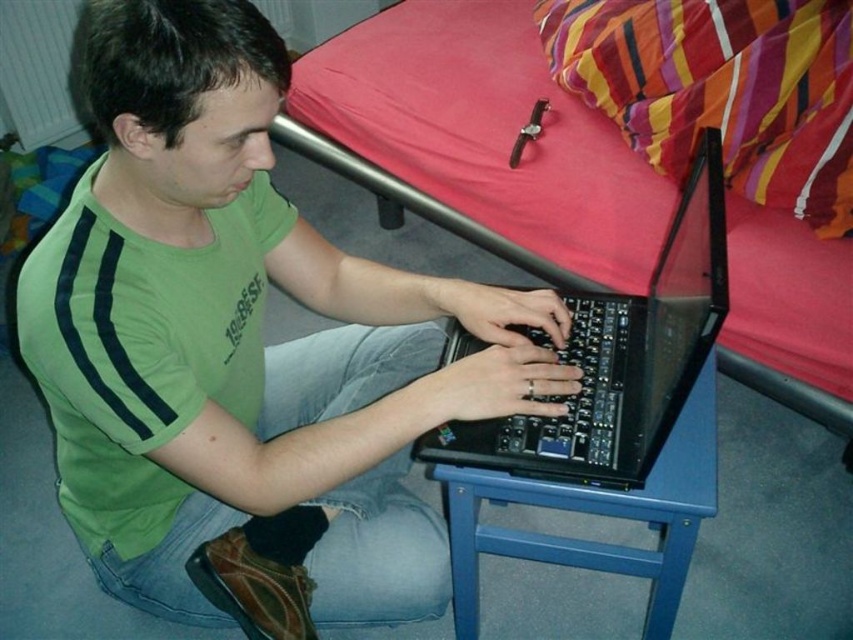
Question: Can you confirm if pink fabric bed at upper center is bigger than black plastic laptop at center?

Choices:
 (A) yes
 (B) no

Answer: (A)

Question: Which is nearer to the black plastic laptop at center?

Choices:
 (A) green fabric shirt at center
 (B) pink fabric bed at upper center
 (C) blue plastic stool at lower center

Answer: (C)

Question: Can you confirm if green fabric shirt at center is wider than pink fabric bed at upper center?

Choices:
 (A) no
 (B) yes

Answer: (A)

Question: Which of these objects is positioned farthest from the pink fabric bed at upper center?

Choices:
 (A) green fabric shirt at center
 (B) blue plastic stool at lower center

Answer: (A)

Question: Which point is farther to the camera?

Choices:
 (A) green fabric shirt at center
 (B) pink fabric bed at upper center
 (C) blue plastic stool at lower center
 (D) black plastic laptop at center

Answer: (B)

Question: Does green fabric shirt at center have a greater width compared to blue plastic stool at lower center?

Choices:
 (A) yes
 (B) no

Answer: (A)